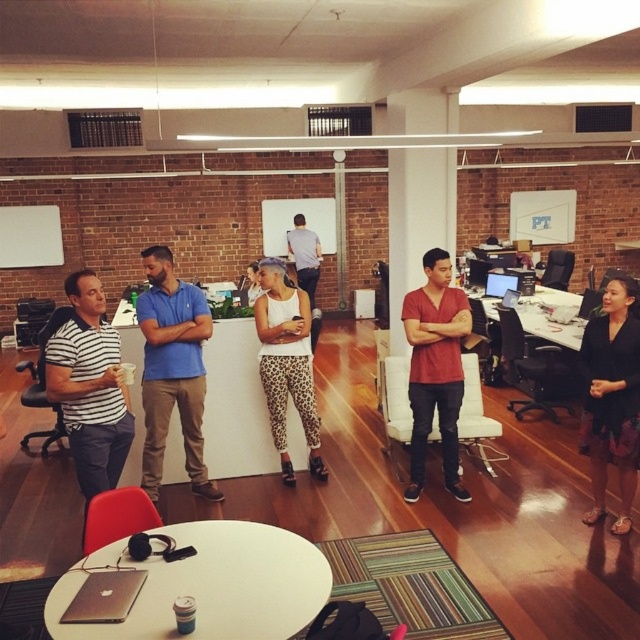
You are a delivery person who needs to place a package between the striped cotton shirt at left and the glossy plastic monitor at center. The package requires 2 feet of space. Can you fit it there?

The distance between the striped cotton shirt at left and the glossy plastic monitor at center is 18.89 feet, so yes, the package requiring 2 feet of space can be placed between them since there is enough space available.

You are standing in the office and want to locate the striped cotton shirt at left. According to the coordinates provided, where would you look relative to the center of the image?

The striped cotton shirt at left is located at coordinates point (90, 387), which means it is 60.5 percent to the right and 14.1 percent below the center of the image.